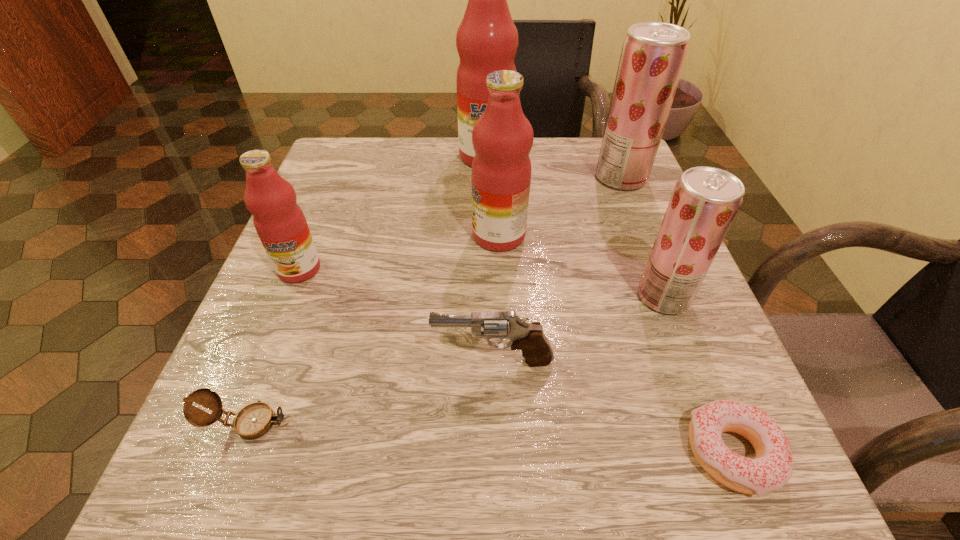
Locate an element on the screen. The image size is (960, 540). free space that is in between the compass and the farthest pink fruit juice is located at coordinates coord(368,289).

At what (x,y) coordinates should I click in order to perform the action: click on vacant space that is in between the second shortest object and the gray pistol. Please return your answer as a coordinate pair (x, y). This screenshot has height=540, width=960. Looking at the image, I should click on (372, 392).

At what (x,y) coordinates should I click in order to perform the action: click on empty space between the white doughnut and the smallest pink fruit juice. Please return your answer as a coordinate pair (x, y). The height and width of the screenshot is (540, 960). Looking at the image, I should click on (516, 361).

At what (x,y) coordinates should I click in order to perform the action: click on free space between the second biggest pink fruit juice and the leftmost fruit juice. Please return your answer as a coordinate pair (x, y). Image resolution: width=960 pixels, height=540 pixels. Looking at the image, I should click on (399, 253).

You are a GUI agent. You are given a task and a screenshot of the screen. Output one action in this format:
    pyautogui.click(x=<x>, y=<y>)
    Task: Click on the unoccupied position between the nearer strawberry fruit juice and the leftmost pink fruit juice
    The image size is (960, 540).
    Given the screenshot: What is the action you would take?
    point(481,283)

You are a GUI agent. You are given a task and a screenshot of the screen. Output one action in this format:
    pyautogui.click(x=<x>, y=<y>)
    Task: Click on the vacant area that lies between the nearer strawberry fruit juice and the white doughnut
    
    Given the screenshot: What is the action you would take?
    pyautogui.click(x=698, y=375)

You are a GUI agent. You are given a task and a screenshot of the screen. Output one action in this format:
    pyautogui.click(x=<x>, y=<y>)
    Task: Click on the free area in between the farther strawberry fruit juice and the seventh tallest object
    The width and height of the screenshot is (960, 540).
    Given the screenshot: What is the action you would take?
    pyautogui.click(x=435, y=300)

Select which object is the fifth closest to the nearer strawberry fruit juice. Please provide its 2D coordinates. Your answer should be formatted as a tuple, i.e. [(x, y)], where the tuple contains the x and y coordinates of a point satisfying the conditions above.

[(487, 40)]

Identify which object is the second closest to the nearer strawberry fruit juice. Please provide its 2D coordinates. Your answer should be formatted as a tuple, i.e. [(x, y)], where the tuple contains the x and y coordinates of a point satisfying the conditions above.

[(536, 349)]

This screenshot has width=960, height=540. What are the coordinates of `the fourth closest fruit juice to the compass` in the screenshot? It's located at (487, 40).